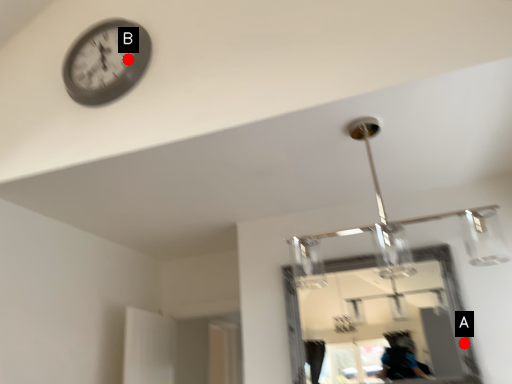
Question: Two points are circled on the image, labeled by A and B beside each circle. Which point appears farthest from the camera in this image?

Choices:
 (A) A is further
 (B) B is further

Answer: (A)